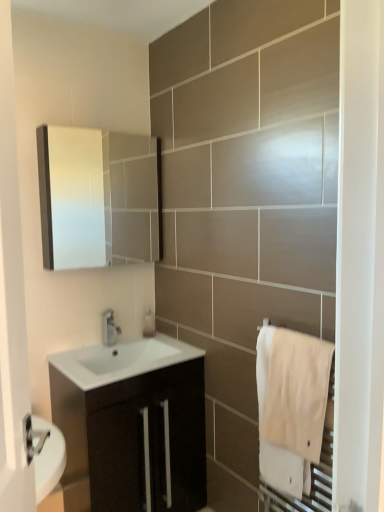
At what (x,y) coordinates should I click in order to perform the action: click on free region under matte white medicine cabinet at upper left (from a real-world perspective). Please return your answer as a coordinate pair (x, y). The width and height of the screenshot is (384, 512). Looking at the image, I should click on (96, 347).